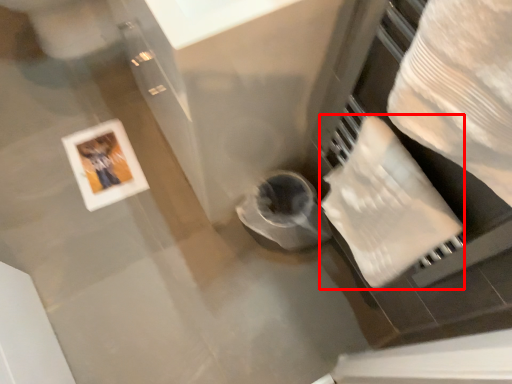
Question: From the image's perspective, where is toilet paper (annotated by the red box) located relative to picture frame?

Choices:
 (A) below
 (B) above

Answer: (A)